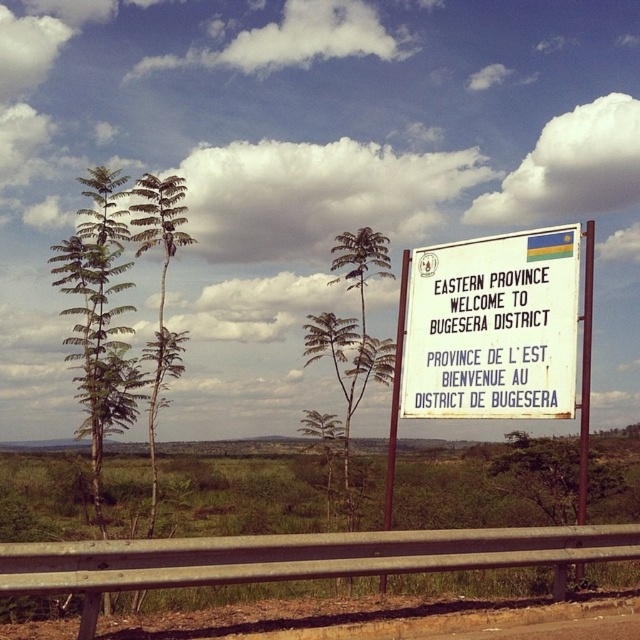
Question: Which object is farther from the camera taking this photo?

Choices:
 (A) green leafy tree at center
 (B) white paper sign at upper right

Answer: (A)

Question: Does green leafy tree at center have a greater width compared to green leafy palm tree at left?

Choices:
 (A) no
 (B) yes

Answer: (A)

Question: Is white paper sign at upper right further to the viewer compared to green leafy tree at center?

Choices:
 (A) yes
 (B) no

Answer: (B)

Question: Which of the following is the farthest from the observer?

Choices:
 (A) (179, 209)
 (B) (353, 260)

Answer: (B)

Question: Which of the following is the closest to the observer?

Choices:
 (A) white paper sign at center
 (B) green leafy palm tree at left
 (C) green leafy tree at center
 (D) white paper sign at upper right

Answer: (A)

Question: Does white paper sign at upper right come in front of green leafy tree at center?

Choices:
 (A) no
 (B) yes

Answer: (B)